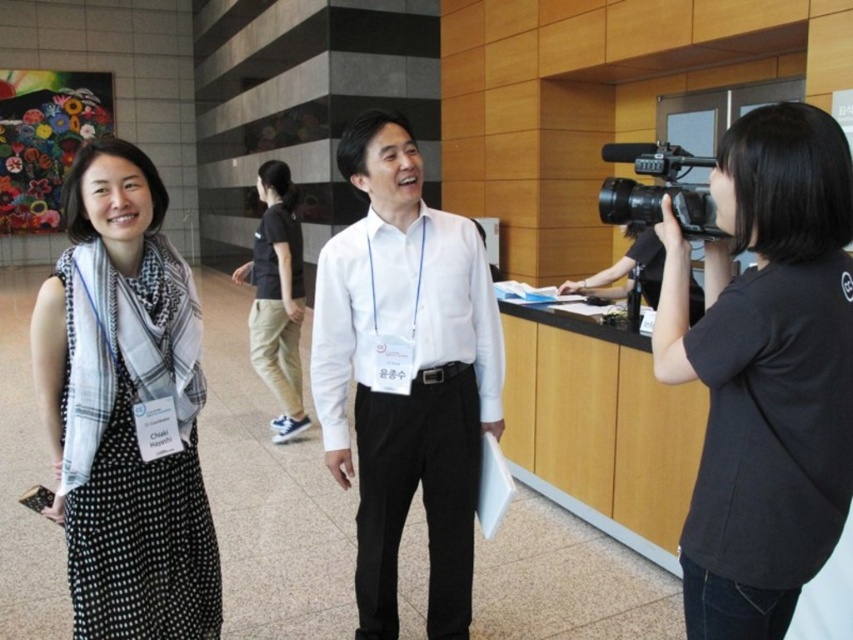
Question: Is black matte camera at right further to the viewer compared to black cotton pants at center?

Choices:
 (A) yes
 (B) no

Answer: (B)

Question: Considering the real-world distances, which object is farthest from the black plastic video camera at right?

Choices:
 (A) white glossy shirt at center
 (B) black matte camera at right
 (C) black dotted dress at left

Answer: (C)

Question: Can you confirm if black cotton pants at center is positioned to the right of black plastic video camera at right?

Choices:
 (A) no
 (B) yes

Answer: (A)

Question: Can you confirm if black matte camera at right is positioned below black dotted dress at left?

Choices:
 (A) yes
 (B) no

Answer: (B)

Question: Estimate the real-world distances between objects in this image. Which object is farther from the black dotted dress at left?

Choices:
 (A) black matte camera at right
 (B) white glossy shirt at center

Answer: (A)

Question: Which of the following is the closest to the observer?

Choices:
 (A) white glossy shirt at center
 (B) black cotton pants at center
 (C) black dotted dress at left
 (D) black matte camera at right

Answer: (D)